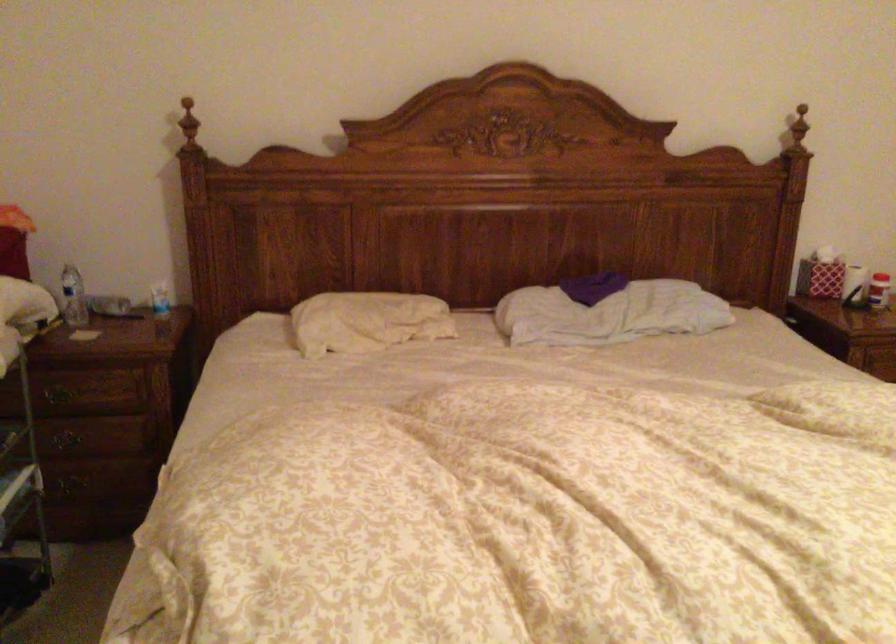
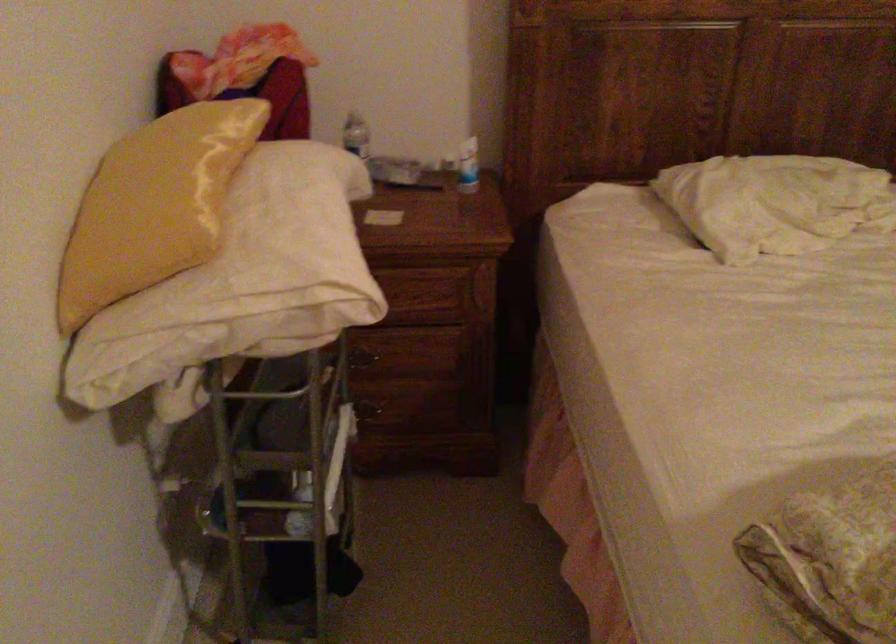
Find the pixel in the second image that matches (157,301) in the first image.

(468, 166)